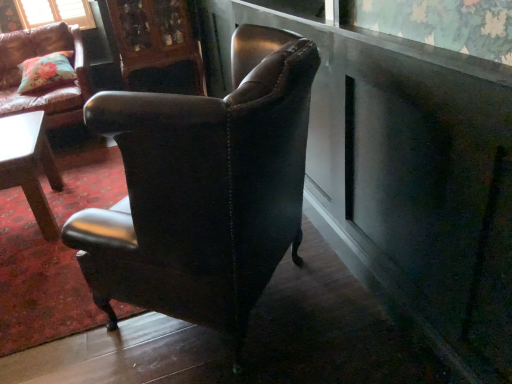
Question: From a real-world perspective, is leather cushioned armchair at upper left, marked as the second chair in a front-to-back arrangement, physically below matte brown leather chair at center, acting as the 2th chair starting from the back?

Choices:
 (A) no
 (B) yes

Answer: (B)

Question: Is matte brown leather chair at center, the first chair positioned from the front, inside leather cushioned armchair at upper left, marked as the second chair in a front-to-back arrangement?

Choices:
 (A) no
 (B) yes

Answer: (A)

Question: Can we say leather cushioned armchair at upper left, acting as the 2th chair starting from the right, lies outside matte brown leather chair at center, the second chair from the left?

Choices:
 (A) no
 (B) yes

Answer: (B)

Question: Is leather cushioned armchair at upper left, which ranks as the 1th chair in left-to-right order, to the left of matte brown leather chair at center, acting as the 2th chair starting from the back, from the viewer's perspective?

Choices:
 (A) yes
 (B) no

Answer: (A)

Question: Is leather cushioned armchair at upper left, which ranks as the 1th chair in left-to-right order, wider than matte brown leather chair at center, acting as the 1th chair starting from the right?

Choices:
 (A) yes
 (B) no

Answer: (A)

Question: Is floral fabric pillow at upper left spatially inside wooden carved cabinet at upper center, or outside of it?

Choices:
 (A) inside
 (B) outside

Answer: (B)

Question: Considering the relative positions of floral fabric pillow at upper left and wooden carved cabinet at upper center in the image provided, is floral fabric pillow at upper left to the left or to the right of wooden carved cabinet at upper center?

Choices:
 (A) left
 (B) right

Answer: (A)

Question: From the image's perspective, is floral fabric pillow at upper left located above or below wooden carved cabinet at upper center?

Choices:
 (A) below
 (B) above

Answer: (A)

Question: Is floral fabric pillow at upper left bigger or smaller than wooden carved cabinet at upper center?

Choices:
 (A) small
 (B) big

Answer: (A)

Question: From a real-world perspective, is floral fabric pillow at upper left positioned above or below leather cushioned armchair at upper left, the 1th chair viewed from the back?

Choices:
 (A) below
 (B) above

Answer: (B)

Question: Based on their sizes in the image, would you say floral fabric pillow at upper left is bigger or smaller than leather cushioned armchair at upper left, which ranks as the 1th chair in left-to-right order?

Choices:
 (A) small
 (B) big

Answer: (A)

Question: Does point (23, 72) appear closer or farther from the camera than point (31, 104)?

Choices:
 (A) closer
 (B) farther

Answer: (B)

Question: Considering the positions of floral fabric pillow at upper left and leather cushioned armchair at upper left, which ranks as the 1th chair in left-to-right order, in the image, is floral fabric pillow at upper left wider or thinner than leather cushioned armchair at upper left, which ranks as the 1th chair in left-to-right order,?

Choices:
 (A) wide
 (B) thin

Answer: (B)

Question: Is leather cushioned armchair at upper left, the 1th chair viewed from the back, bigger or smaller than wooden carved cabinet at upper center?

Choices:
 (A) small
 (B) big

Answer: (B)

Question: Do you think leather cushioned armchair at upper left, which ranks as the 1th chair in left-to-right order, is within wooden carved cabinet at upper center, or outside of it?

Choices:
 (A) inside
 (B) outside

Answer: (B)